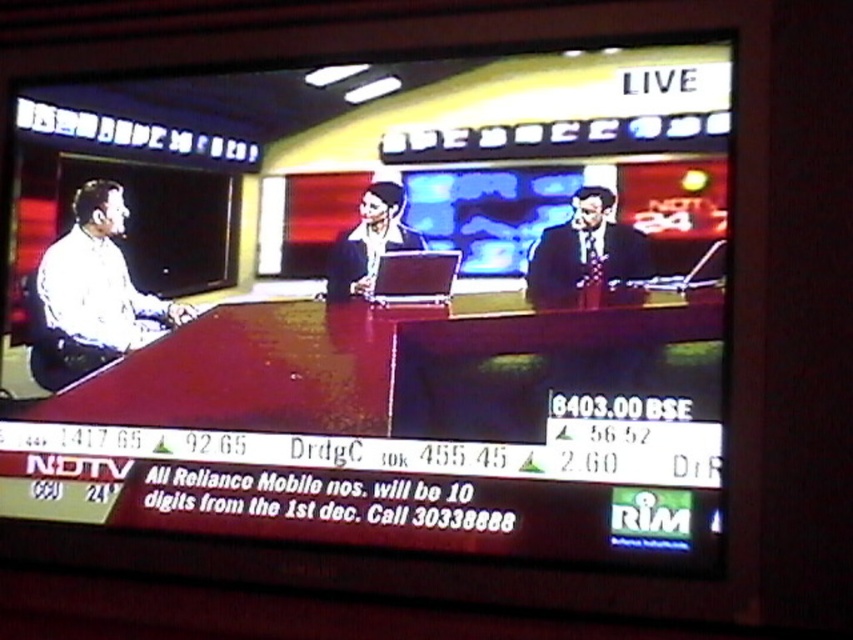
Question: Which is nearer to the matte white shirt at left?

Choices:
 (A) dark blue suit at center
 (B) matte wooden desk at center

Answer: (B)

Question: Is matte wooden desk at center behind dark suit at center?

Choices:
 (A) yes
 (B) no

Answer: (B)

Question: Does matte white shirt at left appear on the right side of dark suit at center?

Choices:
 (A) no
 (B) yes

Answer: (A)

Question: Which object appears farthest from the camera in this image?

Choices:
 (A) matte white shirt at left
 (B) dark suit at center

Answer: (A)

Question: Which of the following is the closest to the observer?

Choices:
 (A) (54, 284)
 (B) (544, 280)
 (C) (358, 240)

Answer: (B)

Question: Is dark suit at center to the right of dark blue suit at center from the viewer's perspective?

Choices:
 (A) yes
 (B) no

Answer: (A)